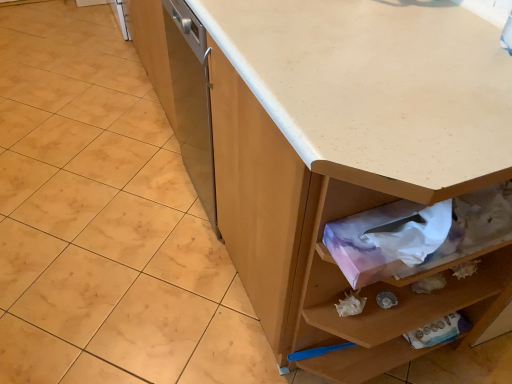
Question: In terms of size, does white laminate countertop at center appear bigger or smaller than white matte granite at center?

Choices:
 (A) small
 (B) big

Answer: (B)

Question: From the image's perspective, is white laminate countertop at center positioned above or below white matte granite at center?

Choices:
 (A) below
 (B) above

Answer: (A)

Question: Which object is positioned farthest from the white matte granite at center?

Choices:
 (A) white laminate countertop at center
 (B) pink paper tissue at lower right

Answer: (A)

Question: Which object is positioned closest to the white matte granite at center?

Choices:
 (A) pink paper tissue at lower right
 (B) white laminate countertop at center

Answer: (A)